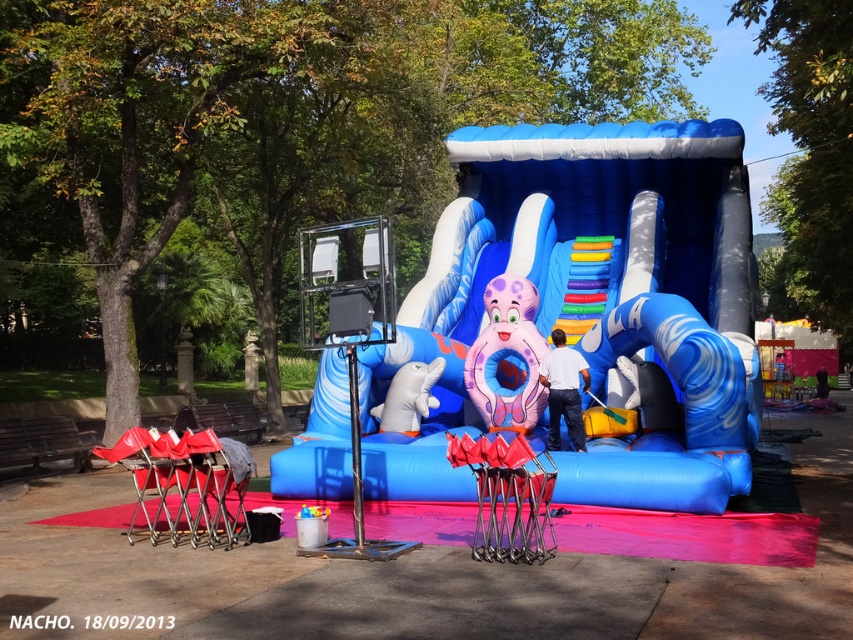
This screenshot has width=853, height=640. What do you see at coordinates (583, 305) in the screenshot?
I see `blue inflatable slide at center` at bounding box center [583, 305].

Can you confirm if blue inflatable slide at center is positioned to the right of pink rubber octopus at center?

Yes, blue inflatable slide at center is to the right of pink rubber octopus at center.

Which is behind, point (468, 314) or point (488, 320)?

The point (468, 314) is behind.

I want to click on blue inflatable slide at center, so click(583, 305).

Which is in front, point (204, 499) or point (410, 428)?

Point (204, 499)

Who is taller, metallic silver folding chair at lower left or white rubber dolphin at lower left?

With more height is white rubber dolphin at lower left.

Describe the element at coordinates (213, 486) in the screenshot. Image resolution: width=853 pixels, height=640 pixels. I see `metallic silver folding chair at lower left` at that location.

Where is `metallic silver folding chair at lower left`? metallic silver folding chair at lower left is located at coordinates tap(213, 486).

Does blue inflatable slide at center appear on the left side of white rubber dolphin at lower left?

Incorrect, blue inflatable slide at center is not on the left side of white rubber dolphin at lower left.

Is blue inflatable slide at center taller than white rubber dolphin at lower left?

Yes, blue inflatable slide at center is taller than white rubber dolphin at lower left.

Does point (471, 307) come farther from viewer compared to point (421, 401)?

Yes.

You are a GUI agent. You are given a task and a screenshot of the screen. Output one action in this format:
    pyautogui.click(x=<x>, y=<y>)
    Task: Click on the blue inflatable slide at center
    The image size is (853, 640).
    Given the screenshot: What is the action you would take?
    pyautogui.click(x=583, y=305)